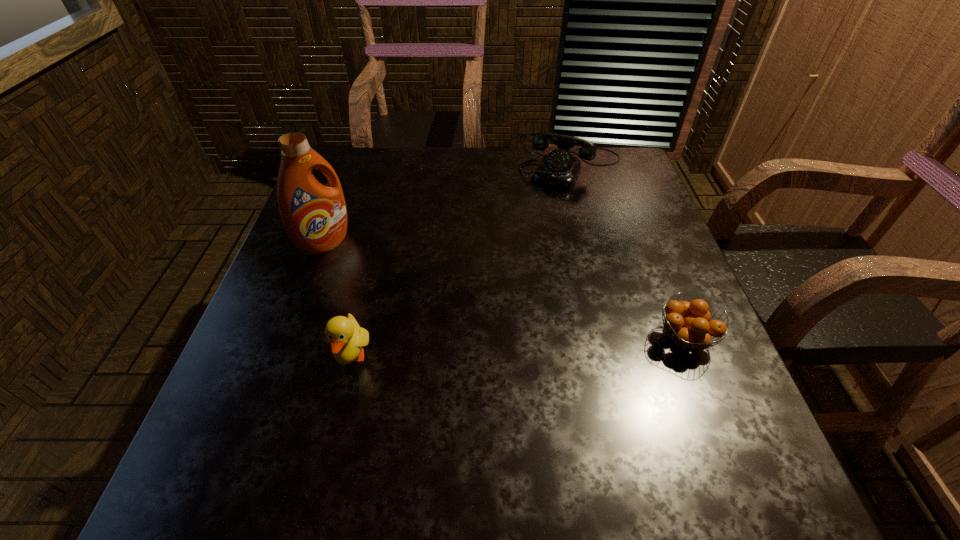
The image size is (960, 540). I want to click on free spot located on the front-facing side of the telephone, so click(538, 226).

Where is `free spot located on the front-facing side of the telephone`? The width and height of the screenshot is (960, 540). free spot located on the front-facing side of the telephone is located at coordinates (544, 212).

This screenshot has width=960, height=540. I want to click on vacant region located 0.270m on the front-facing side of the telephone, so click(524, 251).

Find the location of `object located at the far edge`. object located at the far edge is located at coordinates (559, 168).

Find the location of a particular element. object present at the left edge is located at coordinates (315, 215).

Identify the location of orange fruit positioned at the right edge. This screenshot has height=540, width=960. (688, 323).

Where is `telephone located in the right edge section of the desktop`? The image size is (960, 540). telephone located in the right edge section of the desktop is located at coordinates (559, 168).

Image resolution: width=960 pixels, height=540 pixels. I want to click on object that is at the far right corner, so click(559, 168).

This screenshot has width=960, height=540. In the image, there is a desktop. In order to click on vacant region at the far edge in this screenshot , I will do `click(468, 169)`.

Find the location of `free space at the near edge of the desktop`. free space at the near edge of the desktop is located at coordinates (391, 436).